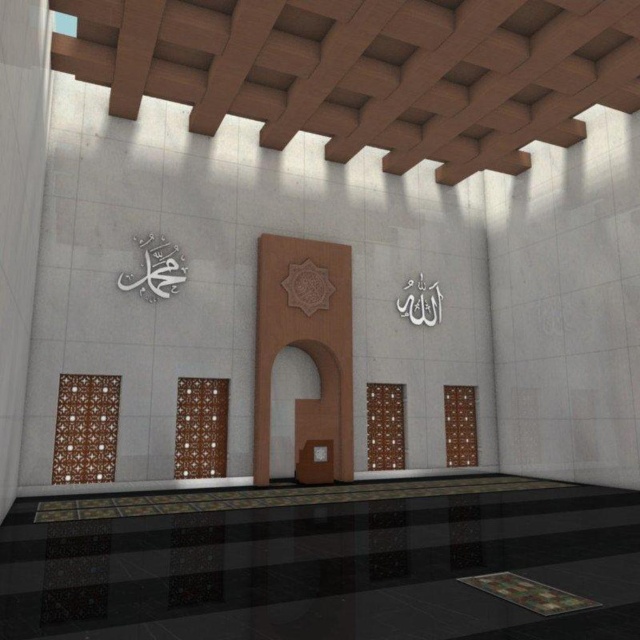
You are an architect designing a new mosque and want to ensure proper alignment of the white metallic calligraphy at upper left and the brown textured tile at center. Based on the image, which object is positioned higher in the space?

The white metallic calligraphy at upper left is positioned higher than the brown textured tile at center.

You are standing in the mosque and want to know how far you are from the mihrab. The mihrab is located at point (326, 349). Can you determine the distance?

The distance between point (326, 349) and the viewer is 46.74 feet, so you are 46.74 feet away from the mihrab.